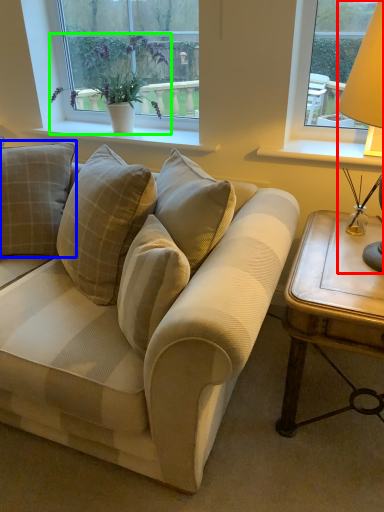
Question: Which object is the farthest from table lamp (highlighted by a red box)? Choose among these: pillow (highlighted by a blue box) or houseplant (highlighted by a green box).

Choices:
 (A) pillow
 (B) houseplant

Answer: (A)